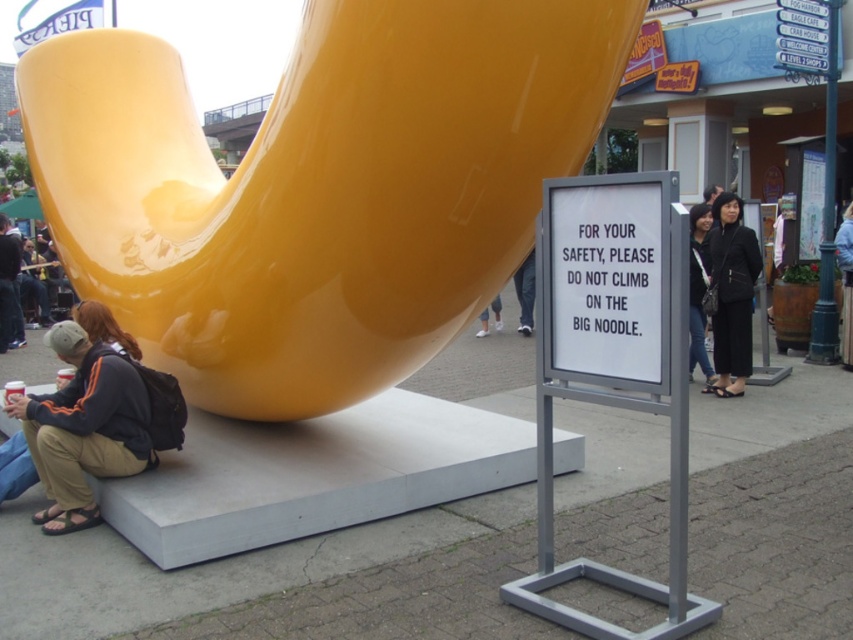
Question: Is glossy yellow slide at center thinner than black fabric pants at right?

Choices:
 (A) no
 (B) yes

Answer: (A)

Question: Which object is positioned farthest from the black fabric pants at right?

Choices:
 (A) matte black jacket at lower left
 (B) black fabric handbag at center
 (C) glossy yellow slide at center

Answer: (A)

Question: Does black fabric pants at right appear over dark gray fabric jacket at center?

Choices:
 (A) no
 (B) yes

Answer: (A)

Question: Which point is closer to the camera taking this photo?

Choices:
 (A) click(x=242, y=356)
 (B) click(x=746, y=355)
 (C) click(x=144, y=461)

Answer: (A)

Question: Can you confirm if matte black jacket at lower left is positioned to the left of black fabric handbag at center?

Choices:
 (A) no
 (B) yes

Answer: (B)

Question: Which point is closer to the camera?

Choices:
 (A) dark gray fabric jacket at center
 (B) black fabric pants at right
 (C) black fabric handbag at center
 (D) matte black jacket at lower left

Answer: (D)